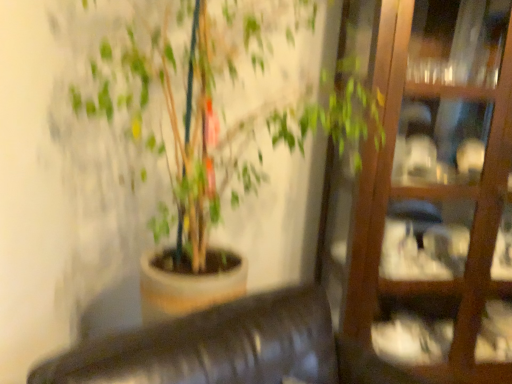
Question: Is matte brown pot at center outside wooden glass door at right?

Choices:
 (A) yes
 (B) no

Answer: (A)

Question: Does matte brown pot at center have a larger size compared to wooden glass door at right?

Choices:
 (A) yes
 (B) no

Answer: (A)

Question: Does matte brown pot at center have a lesser height compared to wooden glass door at right?

Choices:
 (A) yes
 (B) no

Answer: (A)

Question: From the image's perspective, is matte brown pot at center on wooden glass door at right?

Choices:
 (A) no
 (B) yes

Answer: (B)

Question: From a real-world perspective, is matte brown pot at center on top of wooden glass door at right?

Choices:
 (A) no
 (B) yes

Answer: (B)

Question: Can you confirm if matte brown pot at center is positioned to the right of wooden glass door at right?

Choices:
 (A) yes
 (B) no

Answer: (B)

Question: Does wooden glass door at right appear on the right side of matte brown pot at center?

Choices:
 (A) yes
 (B) no

Answer: (A)

Question: Is wooden glass door at right positioned behind matte brown pot at center?

Choices:
 (A) yes
 (B) no

Answer: (A)

Question: Would you consider wooden glass door at right to be distant from matte brown pot at center?

Choices:
 (A) no
 (B) yes

Answer: (A)

Question: Is wooden glass door at right completely or partially outside of matte brown pot at center?

Choices:
 (A) no
 (B) yes

Answer: (B)

Question: Does wooden glass door at right have a lesser height compared to matte brown pot at center?

Choices:
 (A) yes
 (B) no

Answer: (B)

Question: Can you confirm if wooden glass door at right is wider than matte brown pot at center?

Choices:
 (A) yes
 (B) no

Answer: (B)

Question: From the image's perspective, relative to matte brown pot at center, is wooden glass door at right above or below?

Choices:
 (A) above
 (B) below

Answer: (B)